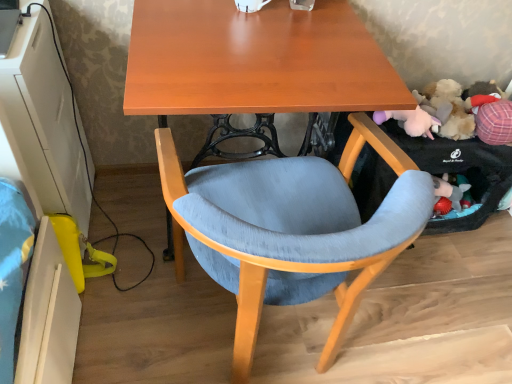
Image resolution: width=512 pixels, height=384 pixels. Find the location of `vacant space that is in between matte wood desk at center and textured fabric chair at center`. vacant space that is in between matte wood desk at center and textured fabric chair at center is located at coordinates (174, 330).